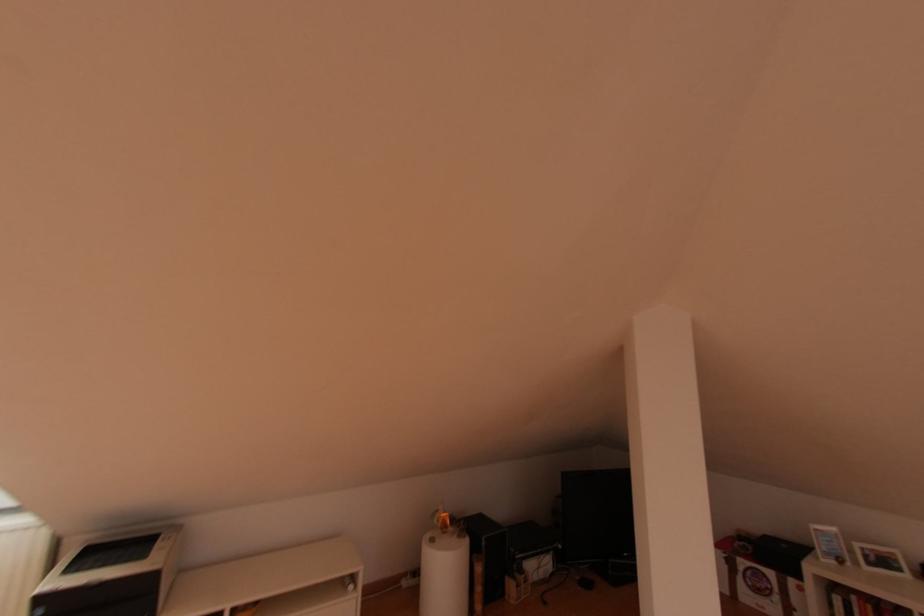
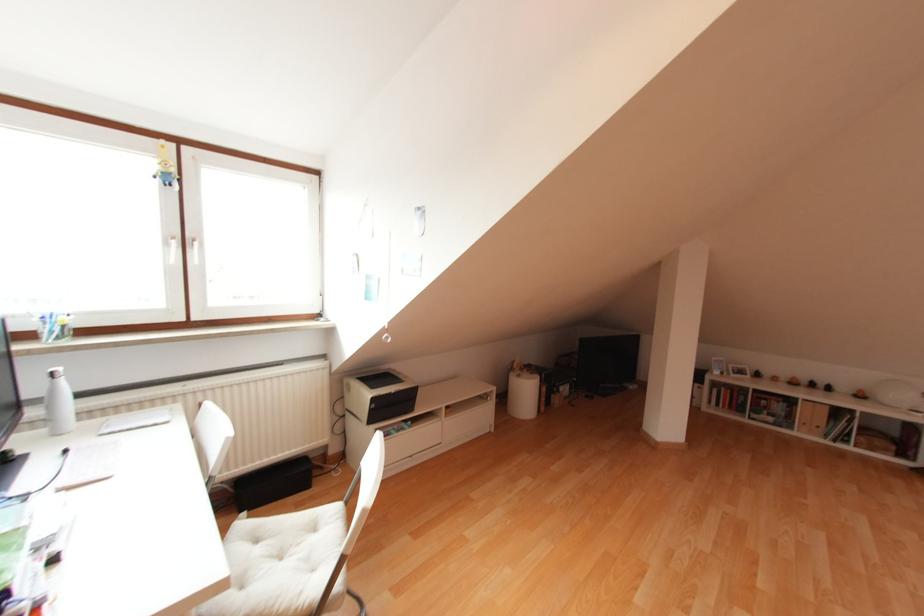
The images are taken continuously from a first-person perspective. In which direction are you moving?

The cameraman moved toward left, backward.